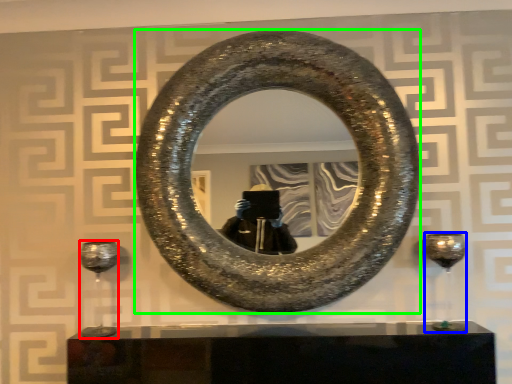
Question: Estimate the real-world distances between objects in this image. Which object is farther from wine glass (highlighted by a red box), wine glass (highlighted by a blue box) or horseshoe (highlighted by a green box)?

Choices:
 (A) wine glass
 (B) horseshoe

Answer: (A)